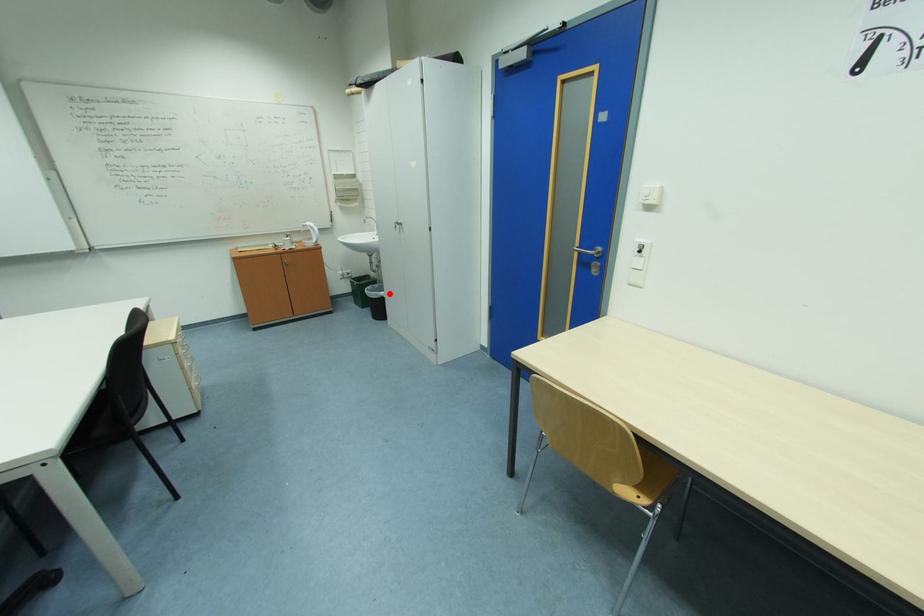
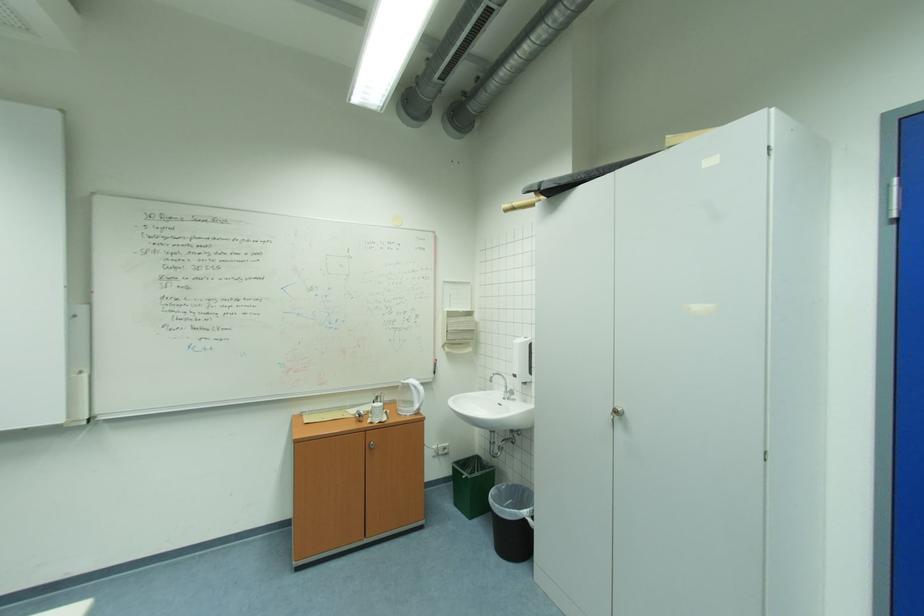
Question: I am providing you with two images of the same scene from different viewpoints. Given a red point in image1, look at the same physical point in image2. Is it:

Choices:
 (A) Closer to the viewpoint
 (B) Farther from the viewpoint

Answer: (B)